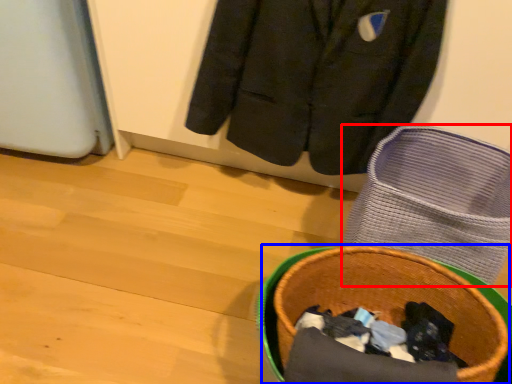
Question: Which object is further to the camera taking this photo, footwear (highlighted by a red box) or basket container (highlighted by a blue box)?

Choices:
 (A) footwear
 (B) basket container

Answer: (A)